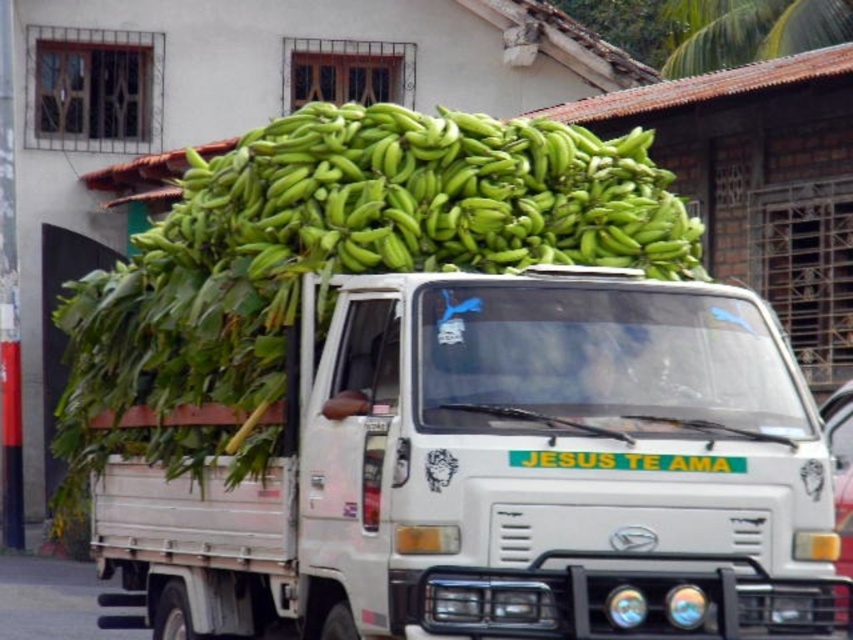
Question: Which object is closer to the camera taking this photo?

Choices:
 (A) green matte bananas at center
 (B) white matte truck at center

Answer: (B)

Question: Can you confirm if white matte truck at center is positioned to the left of green matte bananas at center?

Choices:
 (A) yes
 (B) no

Answer: (A)

Question: Which point is farther from the camera taking this photo?

Choices:
 (A) (637, 209)
 (B) (373, 545)

Answer: (A)

Question: Can you confirm if white matte truck at center is positioned below green matte bananas at center?

Choices:
 (A) no
 (B) yes

Answer: (B)

Question: Can you confirm if white matte truck at center is smaller than green matte bananas at center?

Choices:
 (A) yes
 (B) no

Answer: (B)